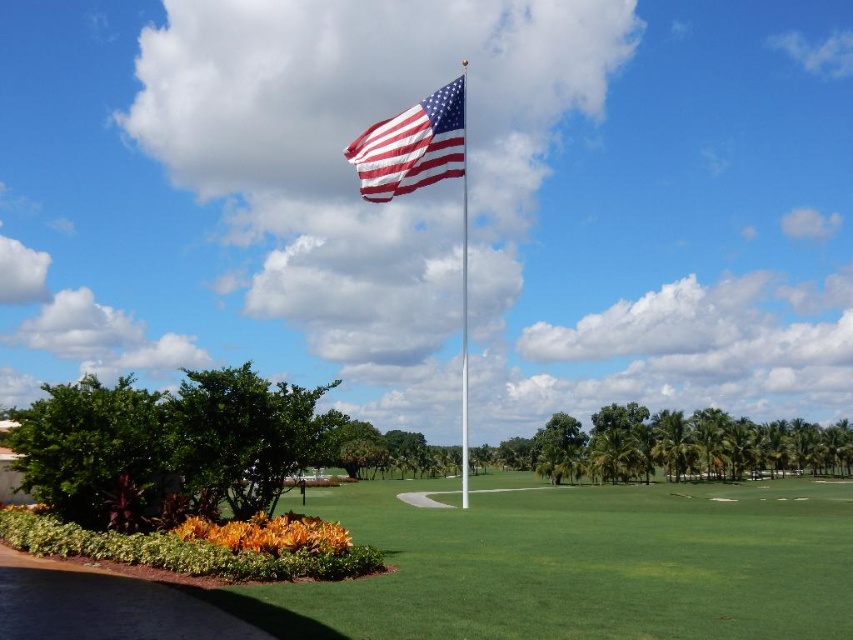
Can you confirm if green grass at center is positioned to the right of polished metal flag pole at center?

Correct, you'll find green grass at center to the right of polished metal flag pole at center.

Is green grass at center taller than polished metal flag pole at center?

Incorrect, green grass at center's height is not larger of polished metal flag pole at center's.

The width and height of the screenshot is (853, 640). What do you see at coordinates (577, 564) in the screenshot?
I see `green grass at center` at bounding box center [577, 564].

Where is `green grass at center`? green grass at center is located at coordinates (577, 564).

Who is taller, green grass at center or american flag at center?

green grass at center is taller.

Is green grass at center below american flag at center?

Yes.

Where is `green grass at center`? Image resolution: width=853 pixels, height=640 pixels. green grass at center is located at coordinates (577, 564).

Who is shorter, american flag at center or polished metal flag pole at center?

With less height is american flag at center.

Image resolution: width=853 pixels, height=640 pixels. Describe the element at coordinates (412, 145) in the screenshot. I see `american flag at center` at that location.

Identify the location of american flag at center. (412, 145).